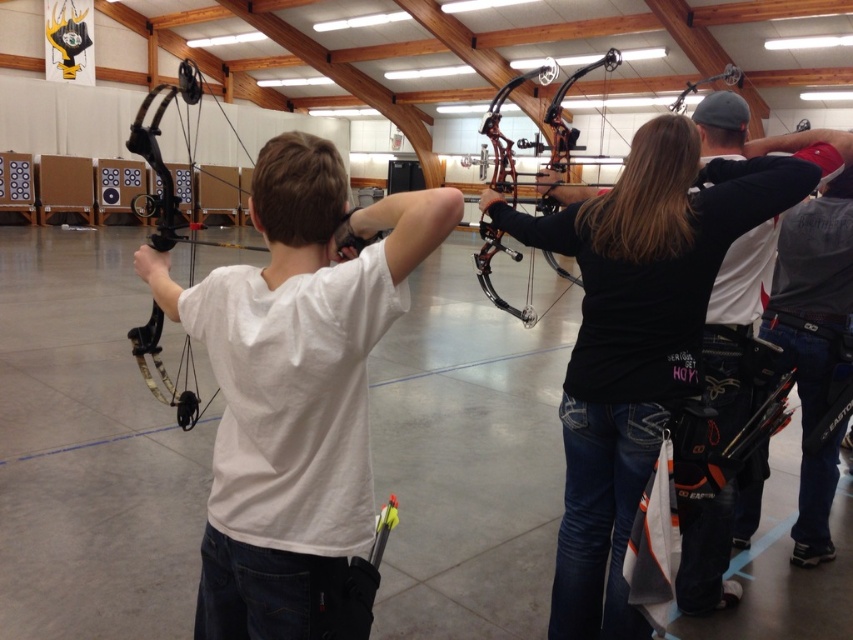
Is point (405, 257) positioned behind point (138, 138)?

That is False.

Measure the distance from white matte shirt at center to matte black bow at left.

white matte shirt at center and matte black bow at left are 5.15 feet apart.

Is point (302, 532) more distant than point (234, 186)?

No, it is not.

Locate an element on the screen. This screenshot has height=640, width=853. white matte shirt at center is located at coordinates (294, 381).

Is point (368, 342) positioned behind point (770, 179)?

That is False.

Is white matte shirt at center to the right of black matte bow at center from the viewer's perspective?

No, white matte shirt at center is not to the right of black matte bow at center.

Find the location of `white matte shirt at center`. white matte shirt at center is located at coordinates (294, 381).

Locate an element on the screen. The image size is (853, 640). white matte shirt at center is located at coordinates tap(294, 381).

Is point (682, 148) closer to viewer compared to point (161, 369)?

That is True.

Is black matte bow at center wider than matte black bow at left?

Incorrect, black matte bow at center's width does not surpass matte black bow at left's.

This screenshot has height=640, width=853. Describe the element at coordinates (636, 339) in the screenshot. I see `black matte bow at center` at that location.

Locate an element on the screen. black matte bow at center is located at coordinates (636, 339).